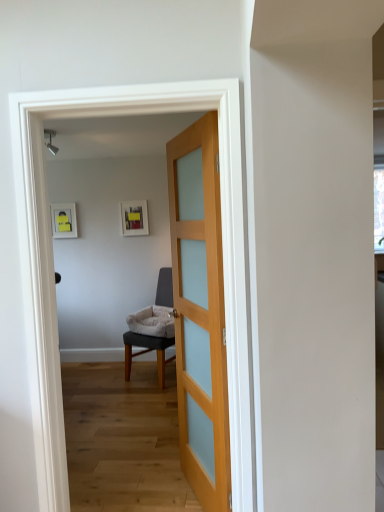
Question: Should I look upward or downward to see light wood/transparent glass door at center?

Choices:
 (A) up
 (B) down

Answer: (B)

Question: Is light gray fabric chair at center not close to light wood/transparent glass door at center?

Choices:
 (A) no
 (B) yes

Answer: (B)

Question: From a real-world perspective, is light gray fabric chair at center positioned under light wood/transparent glass door at center based on gravity?

Choices:
 (A) no
 (B) yes

Answer: (B)

Question: Is light gray fabric chair at center shorter than light wood/transparent glass door at center?

Choices:
 (A) no
 (B) yes

Answer: (B)

Question: Would you say light gray fabric chair at center contains light wood/transparent glass door at center?

Choices:
 (A) no
 (B) yes

Answer: (A)

Question: Could you tell me if light gray fabric chair at center is facing light wood/transparent glass door at center?

Choices:
 (A) yes
 (B) no

Answer: (B)

Question: Does light gray fabric chair at center appear on the right side of light wood/transparent glass door at center?

Choices:
 (A) no
 (B) yes

Answer: (A)

Question: Could you tell me if light wood/transparent glass door at center is facing light gray fabric chair at center?

Choices:
 (A) yes
 (B) no

Answer: (B)

Question: From the image's perspective, is light wood/transparent glass door at center below light gray fabric chair at center?

Choices:
 (A) yes
 (B) no

Answer: (B)

Question: From a real-world perspective, is light wood/transparent glass door at center beneath light gray fabric chair at center?

Choices:
 (A) no
 (B) yes

Answer: (A)

Question: Is light wood/transparent glass door at center positioned in front of light gray fabric chair at center?

Choices:
 (A) yes
 (B) no

Answer: (A)

Question: Can you confirm if light wood/transparent glass door at center is positioned to the right of light gray fabric chair at center?

Choices:
 (A) no
 (B) yes

Answer: (B)

Question: Considering the relative sizes of light wood/transparent glass door at center and light gray fabric chair at center in the image provided, is light wood/transparent glass door at center thinner than light gray fabric chair at center?

Choices:
 (A) yes
 (B) no

Answer: (A)

Question: From a real-world perspective, is light gray fabric chair at center physically located above or below light wood/transparent glass door at center?

Choices:
 (A) above
 (B) below

Answer: (B)